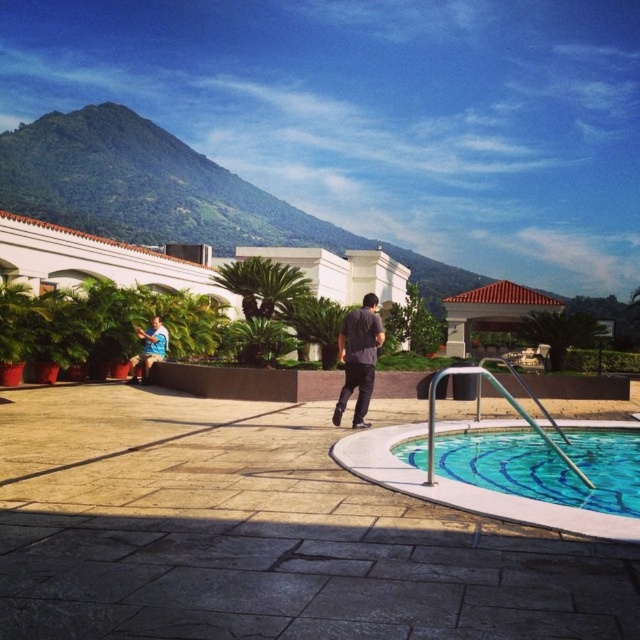
You are a guest at this poolside area and want to know if you can see the bottom of the clear glass pool at lower right from where the dark gray shirt at center is standing. Can you?

The clear glass pool at lower right is shorter than the dark gray shirt at center, so yes, the guest can see the bottom of the clear glass pool at lower right from where the dark gray shirt at center is standing because the pool is not as tall as the shirt.

You are a photographer positioned at the pool edge. You want to capture both the dark gray shirt at center and the blue shirt at lower left in a single frame. Considering their sizes in the image, which subject should you focus on to ensure both are clearly visible?

Since the dark gray shirt at center occupies less space than the blue shirt at lower left, focusing on the dark gray shirt at center would allow the photographer to include both subjects clearly in the frame without cropping either.